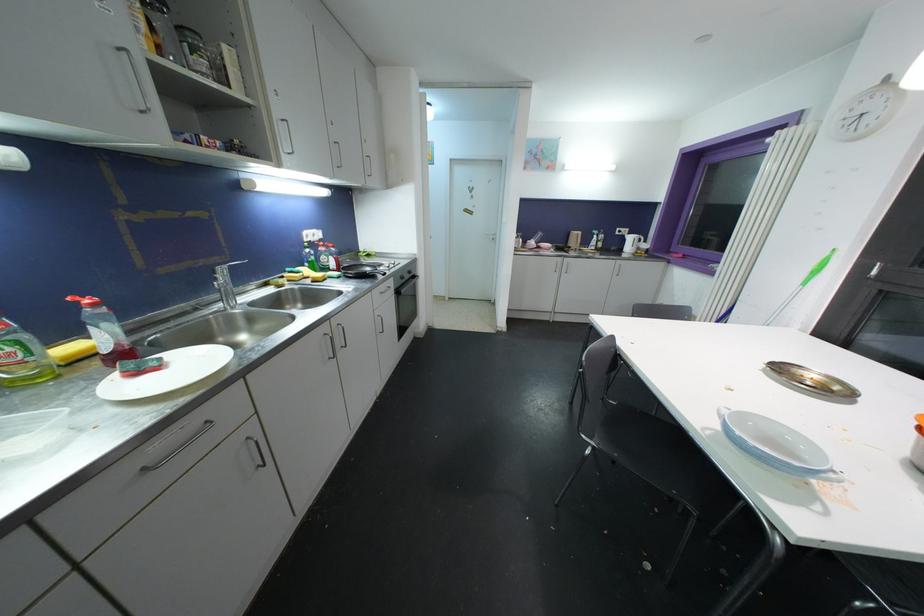
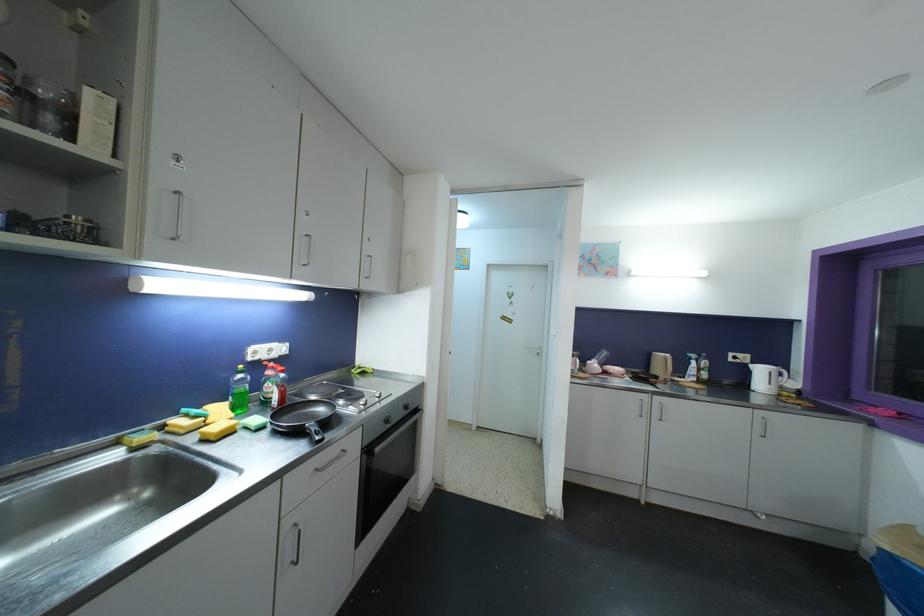
Where in the second image is the point corresponding to point 335,249 from the first image?

(286, 374)